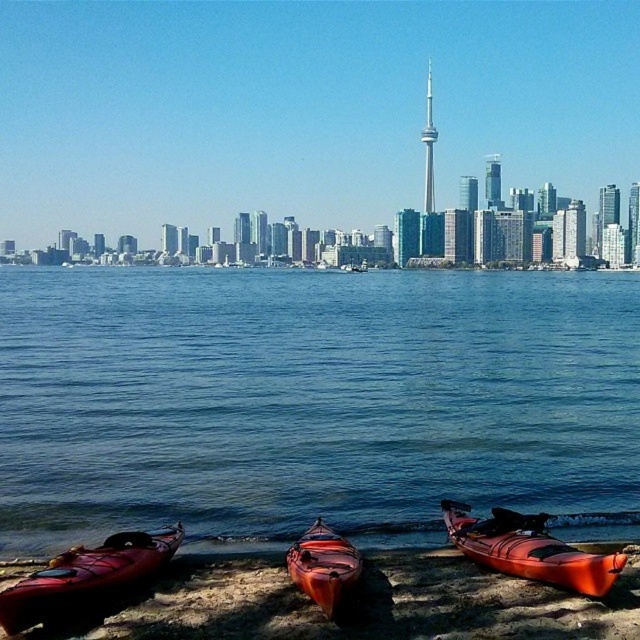
Question: Which object is positioned closest to the blue water at lower center?

Choices:
 (A) orange matte kayak at center
 (B) matte orange canoe at lower left

Answer: (A)

Question: Does blue water at lower center appear on the left side of matte orange canoe at lower left?

Choices:
 (A) no
 (B) yes

Answer: (A)

Question: Which of the following is the farthest from the observer?

Choices:
 (A) (28, 580)
 (B) (516, 365)
 (C) (296, 556)
 (D) (579, 586)

Answer: (B)

Question: Does matte orange canoe at lower left appear over orange matte kayak at lower right?

Choices:
 (A) yes
 (B) no

Answer: (B)

Question: Among these objects, which one is farthest from the camera?

Choices:
 (A) blue water at lower center
 (B) matte orange canoe at lower left
 (C) orange matte kayak at center

Answer: (A)

Question: Is blue water at lower center positioned at the back of orange matte kayak at center?

Choices:
 (A) yes
 (B) no

Answer: (A)